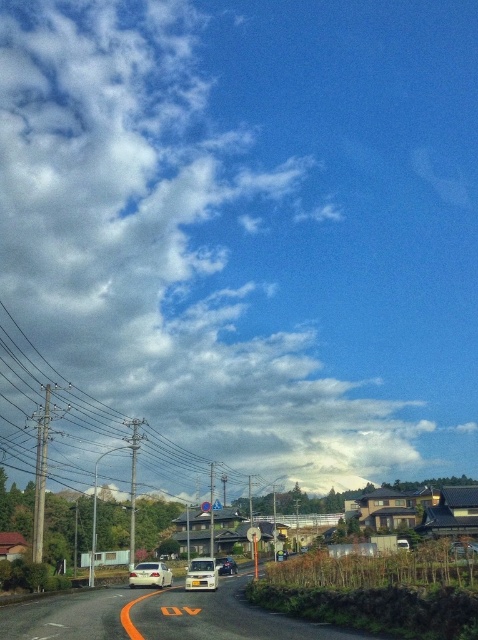
Question: Among these points, which one is nearest to the camera?

Choices:
 (A) (205, 563)
 (B) (83, 483)
 (C) (234, 568)
 (D) (133, 582)

Answer: (A)

Question: Does white matte car at lower left come in front of metallic silver car at center?

Choices:
 (A) no
 (B) yes

Answer: (B)

Question: Estimate the real-world distances between objects in this image. Which object is closer to the metallic silver car at center?

Choices:
 (A) white matte car at lower left
 (B) white matte van at center
 (C) metallic wire at left

Answer: (B)

Question: Is metallic wire at left closer to the viewer compared to metallic silver car at center?

Choices:
 (A) no
 (B) yes

Answer: (B)

Question: Is metallic wire at left thinner than white matte car at lower left?

Choices:
 (A) yes
 (B) no

Answer: (B)

Question: Which of the following is the farthest from the observer?

Choices:
 (A) (137, 586)
 (B) (185, 573)
 (C) (217, 563)

Answer: (B)